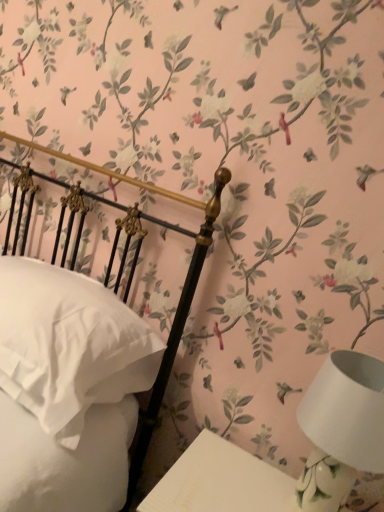
Question: Is white glossy table at lower right aimed at white soft pillow at left?

Choices:
 (A) no
 (B) yes

Answer: (A)

Question: From the image's perspective, is white glossy table at lower right located beneath white soft pillow at left?

Choices:
 (A) yes
 (B) no

Answer: (A)

Question: Would you say white glossy table at lower right is a long distance from white soft pillow at left?

Choices:
 (A) no
 (B) yes

Answer: (A)

Question: Is white glossy table at lower right placed right next to white soft pillow at left?

Choices:
 (A) yes
 (B) no

Answer: (B)

Question: Is white glossy table at lower right taller than white soft pillow at left?

Choices:
 (A) yes
 (B) no

Answer: (A)

Question: Does white glossy table at lower right appear on the left side of white soft pillow at left?

Choices:
 (A) yes
 (B) no

Answer: (B)

Question: From the image's perspective, would you say white soft pillow at left is shown under white glossy table at lower right?

Choices:
 (A) no
 (B) yes

Answer: (A)

Question: Considering the relative sizes of white soft pillow at left and white glossy table at lower right in the image provided, is white soft pillow at left taller than white glossy table at lower right?

Choices:
 (A) no
 (B) yes

Answer: (A)

Question: Is there a large distance between white soft pillow at left and white glossy table at lower right?

Choices:
 (A) yes
 (B) no

Answer: (B)

Question: Is the position of white soft pillow at left more distant than that of white glossy table at lower right?

Choices:
 (A) yes
 (B) no

Answer: (A)

Question: Considering the relative sizes of white soft pillow at left and white glossy table at lower right in the image provided, is white soft pillow at left thinner than white glossy table at lower right?

Choices:
 (A) yes
 (B) no

Answer: (B)

Question: Can you confirm if white soft pillow at left is bigger than white glossy table at lower right?

Choices:
 (A) no
 (B) yes

Answer: (B)

Question: Does white ceramic table lamp at lower right have a larger size compared to white glossy table at lower right?

Choices:
 (A) yes
 (B) no

Answer: (B)